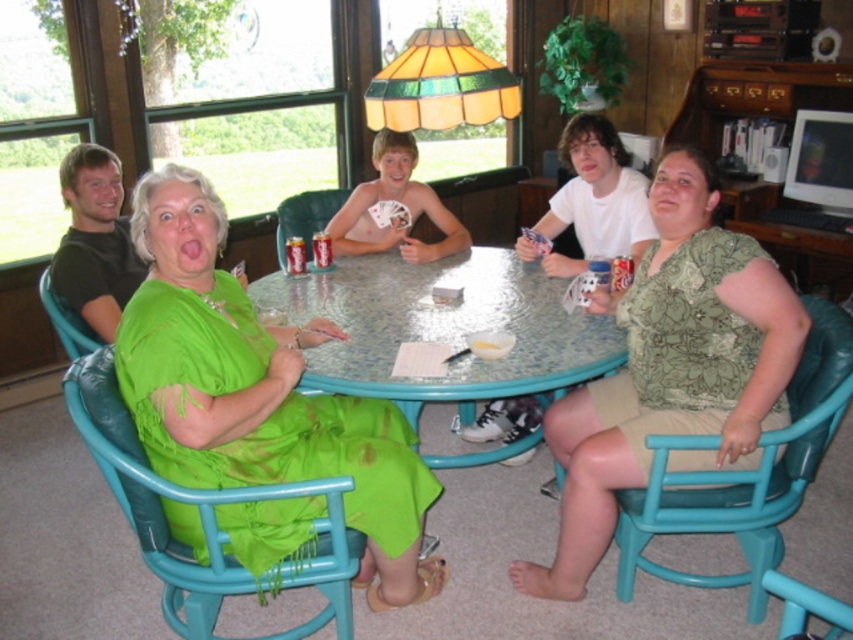
Question: Estimate the real-world distances between objects in this image. Which object is farther from the teal plastic chair at lower left?

Choices:
 (A) green fabric chair at left
 (B) green floral blouse at center
 (C) clear glass table at center

Answer: (B)

Question: Which point is closer to the camera taking this photo?

Choices:
 (A) (172, 195)
 (B) (96, 337)
 (C) (738, 387)
 (D) (178, 573)

Answer: (A)

Question: Is teal plastic chair at lower left thinner than green fabric chair at left?

Choices:
 (A) no
 (B) yes

Answer: (A)

Question: Is clear glass table at center further to the viewer compared to teal plastic chair at lower left?

Choices:
 (A) no
 (B) yes

Answer: (B)

Question: Which of the following is the closest to the observer?

Choices:
 (A) (73, 308)
 (B) (202, 627)
 (C) (136, 298)

Answer: (C)

Question: From the image, what is the correct spatial relationship of green satin dress at center in relation to teal plastic chair at lower left?

Choices:
 (A) below
 (B) above

Answer: (B)